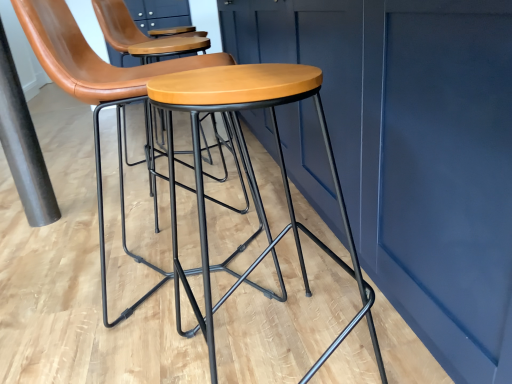
What is the approximate width of matte wood stool at center?

15.44 inches.

The height and width of the screenshot is (384, 512). Find the location of `matte wood stool at center`. matte wood stool at center is located at coordinates (250, 177).

Describe the element at coordinates (23, 145) in the screenshot. I see `black matte pole at left` at that location.

Locate an element on the screen. matte wood stool at center is located at coordinates (250, 177).

Is point (44, 30) closer or farther from the camera than point (324, 244)?

Clearly, point (44, 30) is closer to the camera than point (324, 244).

In terms of size, does matte brown leather stool at center appear bigger or smaller than matte wood stool at center?

matte brown leather stool at center is bigger than matte wood stool at center.

Which is more to the right, matte brown leather stool at center or matte wood stool at center?

From the viewer's perspective, matte wood stool at center appears more on the right side.

Which object is positioned more to the left, matte wood stool at center or black matte pole at left?

Positioned to the left is black matte pole at left.

Is matte wood stool at center in front of or behind black matte pole at left in the image?

matte wood stool at center is in front of black matte pole at left.

From the image's perspective, which one is positioned higher, matte wood stool at center or black matte pole at left?

black matte pole at left.

Where is `stool below the black matte pole at left (from a real-world perspective)`? The width and height of the screenshot is (512, 384). stool below the black matte pole at left (from a real-world perspective) is located at coordinates (250, 177).

What's the angular difference between black matte pole at left and matte brown leather stool at center's facing directions?

83.8 degrees separate the facing orientations of black matte pole at left and matte brown leather stool at center.

From the image's perspective, is black matte pole at left above or below matte brown leather stool at center?

Clearly, from the image's perspective, black matte pole at left is above matte brown leather stool at center.

Is there a large distance between black matte pole at left and matte brown leather stool at center?

No, black matte pole at left is not far from matte brown leather stool at center.

Measure the distance between black matte pole at left and matte brown leather stool at center.

black matte pole at left and matte brown leather stool at center are 64.46 centimeters apart from each other.

Could you tell me if matte wood stool at center is facing matte brown leather stool at center?

No, matte wood stool at center is not oriented towards matte brown leather stool at center.

Image resolution: width=512 pixels, height=384 pixels. What are the coordinates of `chair behind the matte wood stool at center` in the screenshot? It's located at (93, 79).

From the image's perspective, who appears lower, matte wood stool at center or matte brown leather stool at center?

matte wood stool at center is shown below in the image.

Which is in front, point (20, 183) or point (206, 226)?

The point (206, 226) is more forward.

Consider the image. From the image's perspective, who appears lower, black matte pole at left or matte wood stool at center?

From the image's view, matte wood stool at center is below.

From a real-world perspective, is black matte pole at left under matte wood stool at center?

No, from a real-world perspective, black matte pole at left is not below matte wood stool at center.

From the picture: Which of these two, matte brown leather stool at center or black matte pole at left, is bigger?

Bigger between the two is matte brown leather stool at center.

Is matte brown leather stool at center oriented away from black matte pole at left?

matte brown leather stool at center is not turned away from black matte pole at left.

Image resolution: width=512 pixels, height=384 pixels. I want to click on pole above the matte brown leather stool at center (from the image's perspective), so click(x=23, y=145).

Considering the points (63, 24) and (33, 142), which point is in front, point (63, 24) or point (33, 142)?

Positioned in front is point (63, 24).

The height and width of the screenshot is (384, 512). In order to click on stool that appears on the right of matte brown leather stool at center in this screenshot , I will do `click(250, 177)`.

Where is `pole above the matte wood stool at center (from the image's perspective)`? Image resolution: width=512 pixels, height=384 pixels. pole above the matte wood stool at center (from the image's perspective) is located at coordinates (23, 145).

Based on their spatial positions, is matte wood stool at center or black matte pole at left further from matte brown leather stool at center?

black matte pole at left is positioned further to the anchor matte brown leather stool at center.

From the image, which object appears to be farther from matte wood stool at center, black matte pole at left or matte brown leather stool at center?

Among the two, black matte pole at left is located further to matte wood stool at center.

Which object lies nearer to the anchor point black matte pole at left, matte brown leather stool at center or matte wood stool at center?

matte brown leather stool at center is closer to black matte pole at left.

Considering their positions, is matte wood stool at center positioned further to black matte pole at left than matte brown leather stool at center?

Among the two, matte wood stool at center is located further to black matte pole at left.

When comparing their distances from matte brown leather stool at center, does black matte pole at left or matte wood stool at center seem further?

black matte pole at left is further to matte brown leather stool at center.

Considering their positions, is matte brown leather stool at center positioned further to matte wood stool at center than black matte pole at left?

Among the two, black matte pole at left is located further to matte wood stool at center.

Find the location of a particular element. The width and height of the screenshot is (512, 384). chair between matte wood stool at center and black matte pole at left in the front-back direction is located at coordinates (93, 79).